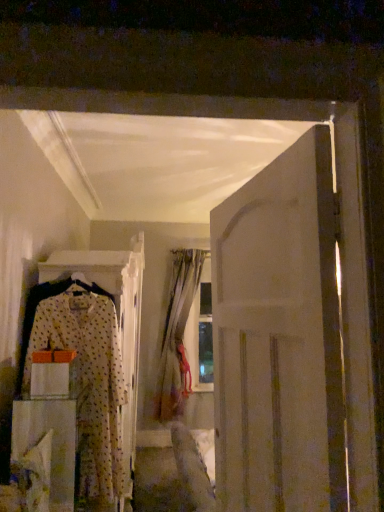
Question: Is polka dot fabric dress at left touching silky beige curtain at center?

Choices:
 (A) yes
 (B) no

Answer: (B)

Question: Could you tell me if polka dot fabric dress at left is turned towards silky beige curtain at center?

Choices:
 (A) yes
 (B) no

Answer: (B)

Question: Is polka dot fabric dress at left completely or partially outside of silky beige curtain at center?

Choices:
 (A) no
 (B) yes

Answer: (B)

Question: From a real-world perspective, is polka dot fabric dress at left physically below silky beige curtain at center?

Choices:
 (A) no
 (B) yes

Answer: (B)

Question: Is polka dot fabric dress at left at the left side of silky beige curtain at center?

Choices:
 (A) yes
 (B) no

Answer: (A)

Question: From the image's perspective, is polka dot fabric dress at left above silky beige curtain at center?

Choices:
 (A) yes
 (B) no

Answer: (A)

Question: Is polka dot fabric dress at left located outside white fabric drawer at lower left?

Choices:
 (A) no
 (B) yes

Answer: (B)

Question: Considering the relative positions of polka dot fabric dress at left and white fabric drawer at lower left in the image provided, is polka dot fabric dress at left in front of white fabric drawer at lower left?

Choices:
 (A) no
 (B) yes

Answer: (A)

Question: Is polka dot fabric dress at left aimed at white fabric drawer at lower left?

Choices:
 (A) no
 (B) yes

Answer: (B)

Question: Would you say white fabric drawer at lower left is part of polka dot fabric dress at left's contents?

Choices:
 (A) yes
 (B) no

Answer: (B)

Question: Is polka dot fabric dress at left positioned with its back to white fabric drawer at lower left?

Choices:
 (A) no
 (B) yes

Answer: (B)

Question: Considering the relative positions of polka dot fabric dress at left and white fabric drawer at lower left in the image provided, is polka dot fabric dress at left to the left of white fabric drawer at lower left from the viewer's perspective?

Choices:
 (A) yes
 (B) no

Answer: (B)

Question: Is the surface of silky beige curtain at center in direct contact with polka dot fabric dress at left?

Choices:
 (A) yes
 (B) no

Answer: (B)